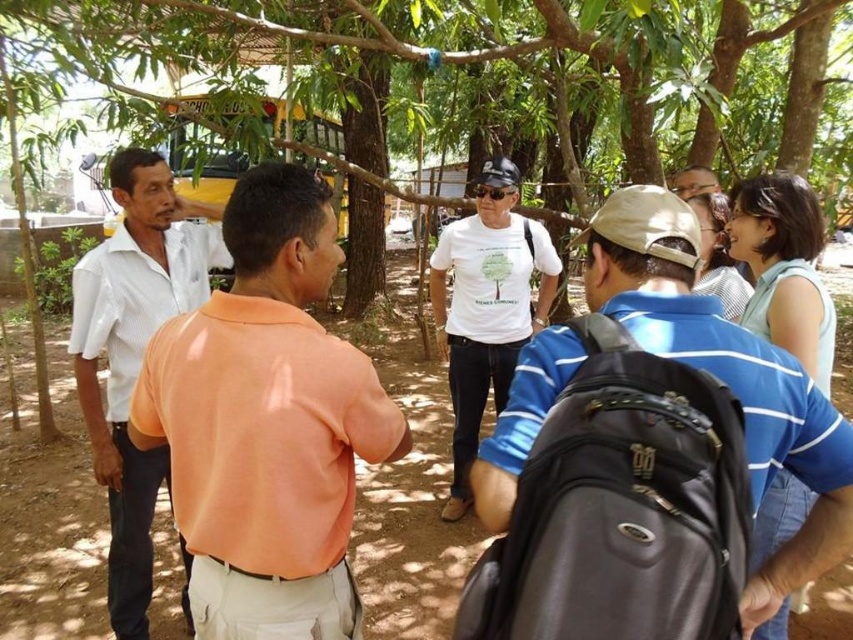
Does orange matte shirt at center appear over white striped shirt at left?

Yes, orange matte shirt at center is above white striped shirt at left.

Does orange matte shirt at center have a lesser width compared to white striped shirt at left?

Incorrect, orange matte shirt at center's width is not less than white striped shirt at left's.

Identify the location of orange matte shirt at center. Image resolution: width=853 pixels, height=640 pixels. (267, 422).

Between white cotton t-shirt at center and beige fabric shirt at upper right, which one is positioned higher?

beige fabric shirt at upper right is above.

Is point (488, 368) in front of point (695, 170)?

No, it is not.

Identify the location of white cotton t-shirt at center. (486, 307).

Is white matte t-shirt at center thinner than beige fabric shirt at upper right?

No.

Who is positioned more to the right, white matte t-shirt at center or beige fabric shirt at upper right?

From the viewer's perspective, beige fabric shirt at upper right appears more on the right side.

This screenshot has height=640, width=853. I want to click on white matte t-shirt at center, so click(726, 376).

Image resolution: width=853 pixels, height=640 pixels. I want to click on white matte t-shirt at center, so click(x=726, y=376).